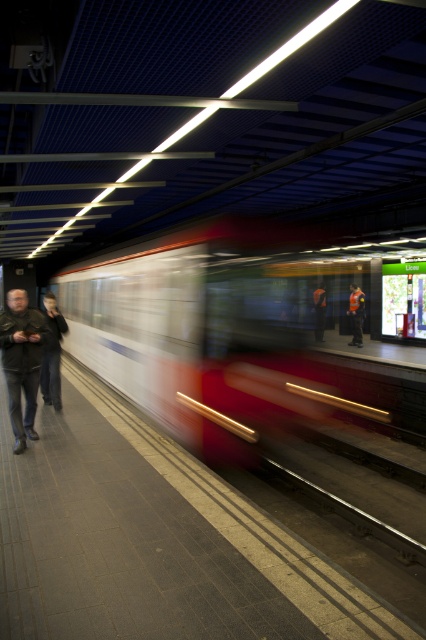
Does white glossy train at center appear on the right side of dark gray jeans at left?

Indeed, white glossy train at center is positioned on the right side of dark gray jeans at left.

Who is taller, white glossy train at center or dark gray jeans at left?

white glossy train at center

Find the location of a particular element. Image resolution: width=426 pixels, height=640 pixels. white glossy train at center is located at coordinates click(x=235, y=332).

Does point (307, 548) lie behind point (161, 406)?

No.

Does point (221, 582) lie behind point (262, 371)?

No.

What are the coordinates of `smooth concrete platform at center` in the screenshot? It's located at (157, 541).

Is leather jacket at left smaller than orange reflective vest at center?

No, leather jacket at left is not smaller than orange reflective vest at center.

Looking at this image, between leather jacket at left and orange reflective vest at center, which one appears on the left side from the viewer's perspective?

leather jacket at left is more to the left.

Does point (34, 353) come behind point (319, 328)?

No.

I want to click on leather jacket at left, so click(22, 362).